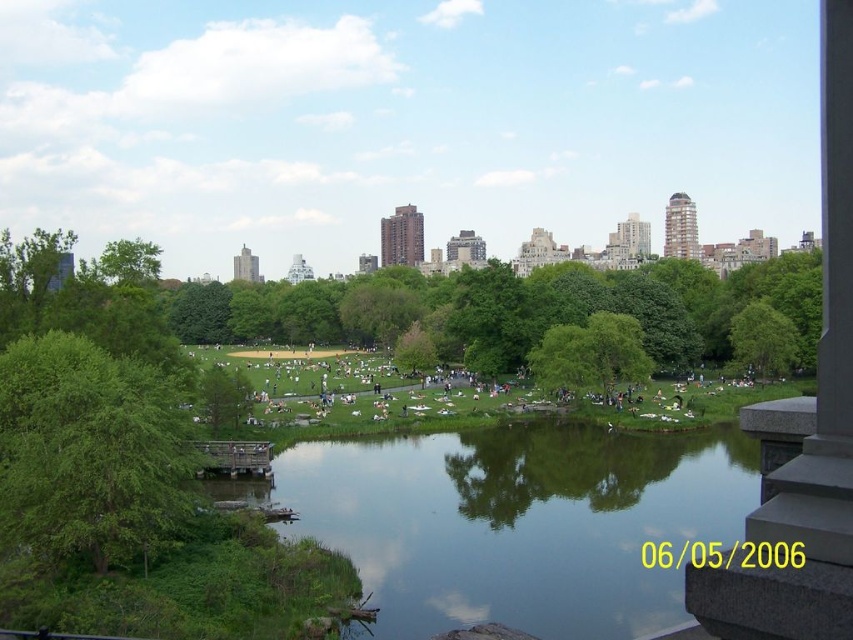
Is point (442, 524) closer to camera compared to point (401, 348)?

That is True.

Is green grassy river at center smaller than green leafy tree at center?

No, green grassy river at center is not smaller than green leafy tree at center.

Measure the distance between point [373,522] and camera.

They are 256.19 meters apart.

Find the location of a particular element. green grassy river at center is located at coordinates (514, 522).

Consider the image. Which is above, green leafy tree at center-right or green leafy tree at center?

green leafy tree at center-right is higher up.

Image resolution: width=853 pixels, height=640 pixels. What do you see at coordinates (763, 340) in the screenshot?
I see `green leafy tree at center-right` at bounding box center [763, 340].

Locate an element on the screen. The width and height of the screenshot is (853, 640). green leafy tree at center-right is located at coordinates tap(763, 340).

Identify the location of green leafy tree at center-right. The width and height of the screenshot is (853, 640). click(763, 340).

Who is shorter, green grassy river at center or green leafy tree at left?

green grassy river at center is shorter.

How far apart are green grassy river at center and green leafy tree at left?

green grassy river at center and green leafy tree at left are 61.29 meters apart.

Between point (258, 492) and point (142, 500), which one is positioned behind?

The point (258, 492) is more distant.

What are the coordinates of `green grassy river at center` in the screenshot? It's located at (514, 522).